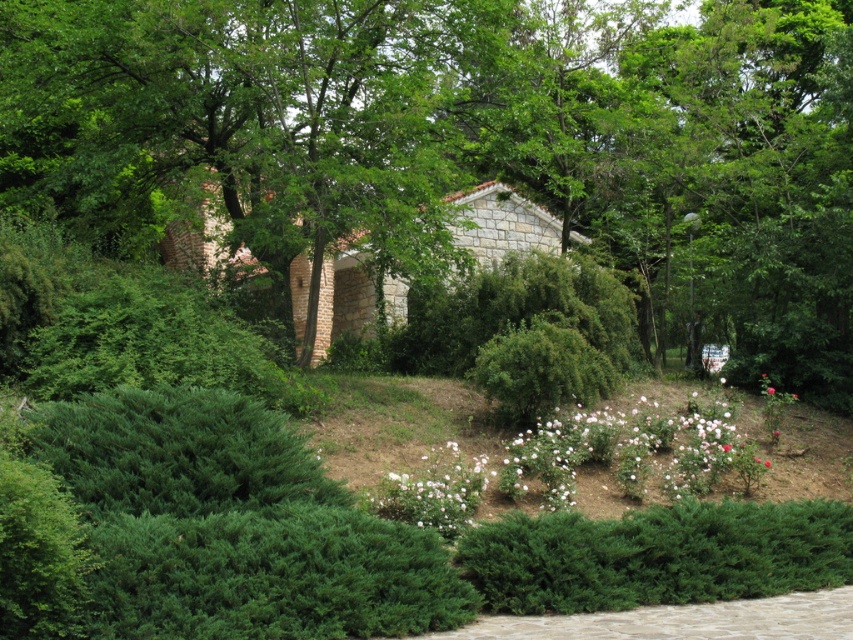
Does green textured hedge at lower center appear under white matte flowers at center?

Correct, green textured hedge at lower center is located below white matte flowers at center.

Is green textured hedge at lower center thinner than white matte flowers at center?

Yes.

Measure the distance between green textured hedge at lower center and camera.

They are 8.87 meters apart.

Identify the location of green textured hedge at lower center. This screenshot has height=640, width=853. (657, 556).

Does point (517, 368) come farther from viewer compared to point (770, 388)?

That is False.

Is point (517, 394) closer to viewer compared to point (767, 394)?

Yes, point (517, 394) is in front of point (767, 394).

The image size is (853, 640). Find the location of `green textured hedge at center`. green textured hedge at center is located at coordinates (540, 371).

Is point (729, 58) less distant than point (178, 609)?

No, (729, 58) is further to viewer.

In the scene shown: Is green leafy tree at center shorter than green textured hedge at lower left?

Incorrect, green leafy tree at center's height does not fall short of green textured hedge at lower left's.

Who is more forward, (276, 97) or (196, 474)?

Point (196, 474) is in front.

This screenshot has height=640, width=853. What are the coordinates of `green leafy tree at center` in the screenshot? It's located at 468,140.